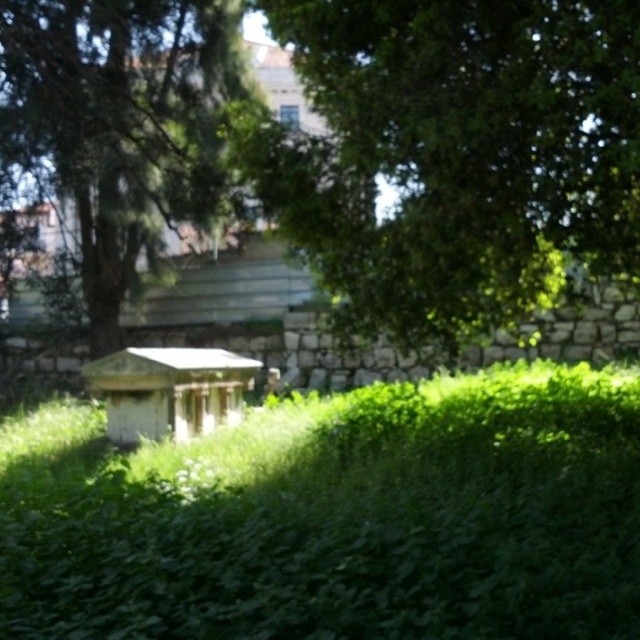
In the scene shown: You are a bird looking for a nesting spot. You see two green leafy trees in the garden scene. Which tree, the green leafy tree at upper center or the green leafy tree at center, is shorter and thus safer for a small nest?

The green leafy tree at upper center is not as tall as the green leafy tree at center, making it the shorter tree and safer for a small nest.

You are standing in the garden and want to place a small statue between the green leafy grass at center and the green leafy tree at center. Based on their positions, where should the statue be placed relative to the tree?

The green leafy grass at center is below the green leafy tree at center, so the statue should be placed between them, below the tree and above the grass.

You are standing in the garden and want to take a photo of the green leafy tree at upper center. If you use a camera with a 50mm lens, which has a field of view of 46 degrees, can you fit the entire tree into the frame while standing at the current position?

The green leafy tree at upper center is located at coordinates (464, 150) in the image. Since the camera has a 50mm lens with a 46 degree field of view, the exact positioning and distance would determine if the tree fits. However, without knowing the distance from the camera to the tree, it is impossible to definitively answer if the entire tree can be captured in the frame.